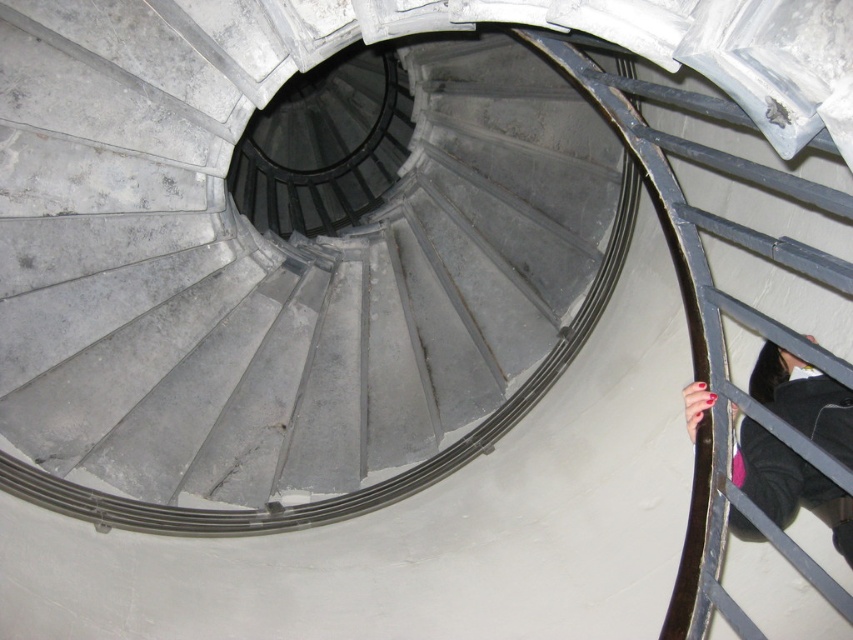
Which is in front, point (585, 109) or point (850, 449)?

Point (850, 449) is more forward.

Who is positioned more to the left, gray concrete spiral staircase at center or dark gray fabric hand at lower right?

From the viewer's perspective, gray concrete spiral staircase at center appears more on the left side.

Locate an element on the screen. This screenshot has width=853, height=640. gray concrete spiral staircase at center is located at coordinates (363, 316).

Where is `gray concrete spiral staircase at center`? The height and width of the screenshot is (640, 853). gray concrete spiral staircase at center is located at coordinates (363, 316).